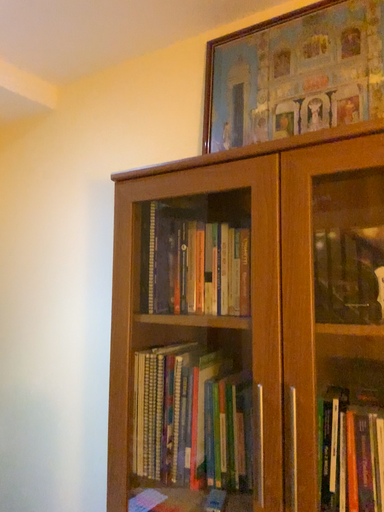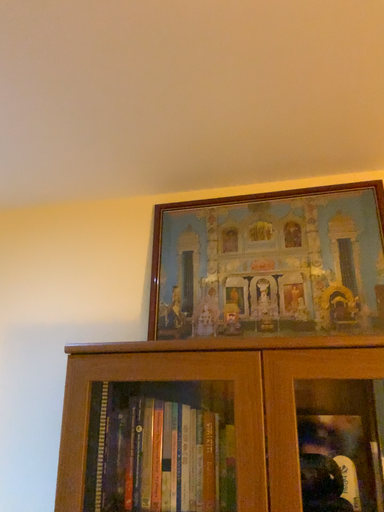
Question: Which way did the camera rotate in the video?

Choices:
 (A) rotated downward
 (B) rotated upward

Answer: (B)